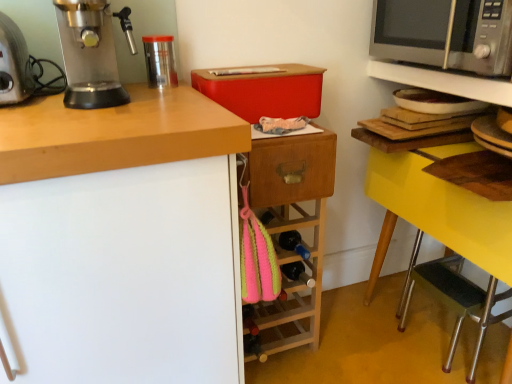
Question: From the image's perspective, is yellow wood table at right, which ranks as the 2th shelf in top-to-bottom order, under metallic silver espresso machine at left?

Choices:
 (A) yes
 (B) no

Answer: (A)

Question: Could metallic silver espresso machine at left be considered to be inside yellow wood table at right, acting as the first shelf starting from the bottom?

Choices:
 (A) no
 (B) yes

Answer: (A)

Question: Is yellow wood table at right, acting as the first shelf starting from the bottom, further to camera compared to metallic silver espresso machine at left?

Choices:
 (A) no
 (B) yes

Answer: (B)

Question: Considering the relative sizes of yellow wood table at right, acting as the first shelf starting from the bottom, and metallic silver espresso machine at left in the image provided, is yellow wood table at right, acting as the first shelf starting from the bottom, wider than metallic silver espresso machine at left?

Choices:
 (A) no
 (B) yes

Answer: (B)

Question: From a real-world perspective, is yellow wood table at right, acting as the first shelf starting from the bottom, below metallic silver espresso machine at left?

Choices:
 (A) yes
 (B) no

Answer: (A)

Question: In terms of size, does metallic silver microwave at upper right, which appears as the second shelf when ordered from the bottom, appear bigger or smaller than black rubber step stool at lower right?

Choices:
 (A) big
 (B) small

Answer: (B)

Question: From a real-world perspective, is metallic silver microwave at upper right, the first shelf viewed from the top, above or below black rubber step stool at lower right?

Choices:
 (A) below
 (B) above

Answer: (B)

Question: Does point (415, 64) appear closer or farther from the camera than point (510, 309)?

Choices:
 (A) farther
 (B) closer

Answer: (A)

Question: Considering their positions, is metallic silver microwave at upper right, the first shelf viewed from the top, located in front of or behind black rubber step stool at lower right?

Choices:
 (A) behind
 (B) front

Answer: (B)

Question: Is black rubber step stool at lower right bigger or smaller than wooden drawer at center?

Choices:
 (A) small
 (B) big

Answer: (B)

Question: Would you say black rubber step stool at lower right is inside or outside wooden drawer at center?

Choices:
 (A) outside
 (B) inside

Answer: (A)

Question: Looking at their shapes, would you say black rubber step stool at lower right is wider or thinner than wooden drawer at center?

Choices:
 (A) wide
 (B) thin

Answer: (A)

Question: From the image's perspective, is black rubber step stool at lower right positioned above or below wooden drawer at center?

Choices:
 (A) below
 (B) above

Answer: (A)

Question: Is satin silver microwave at upper right inside or outside of wooden drawer at center?

Choices:
 (A) inside
 (B) outside

Answer: (B)

Question: Visually, is satin silver microwave at upper right positioned to the left or to the right of wooden drawer at center?

Choices:
 (A) left
 (B) right

Answer: (B)